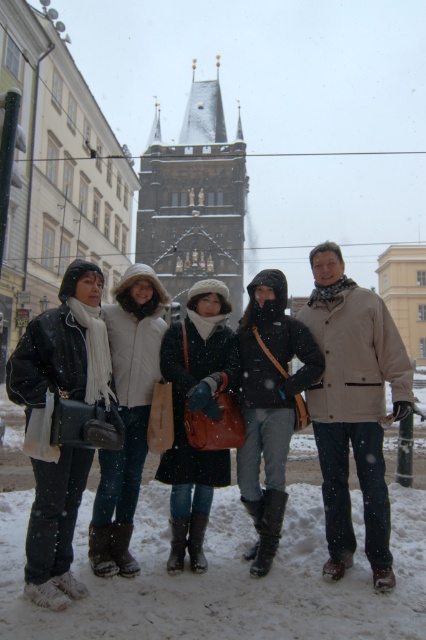
You are a GUI agent. You are given a task and a screenshot of the screen. Output one action in this format:
    pyautogui.click(x=<x>, y=<y>)
    Task: Click on the matte black jacket at left
    This screenshot has width=426, height=640.
    Given the screenshot: What is the action you would take?
    tap(63, 346)

From the picture: Can you confirm if matte black jacket at left is bigger than matte black coat at center?

Correct, matte black jacket at left is larger in size than matte black coat at center.

At what (x,y) coordinates should I click in order to perform the action: click on matte black jacket at left. Please return your answer as a coordinate pair (x, y). Looking at the image, I should click on (63, 346).

Can you confirm if brown stone tower at center is wider than white woolen hat at center?

Indeed, brown stone tower at center has a greater width compared to white woolen hat at center.

The width and height of the screenshot is (426, 640). In order to click on brown stone tower at center in this screenshot , I will do `click(195, 198)`.

Does matte black coat at center have a lesser width compared to white woolen hat at center?

Incorrect, matte black coat at center's width is not less than white woolen hat at center's.

The width and height of the screenshot is (426, 640). Describe the element at coordinates (193, 413) in the screenshot. I see `matte black coat at center` at that location.

Locate an element on the screen. matte black coat at center is located at coordinates point(193,413).